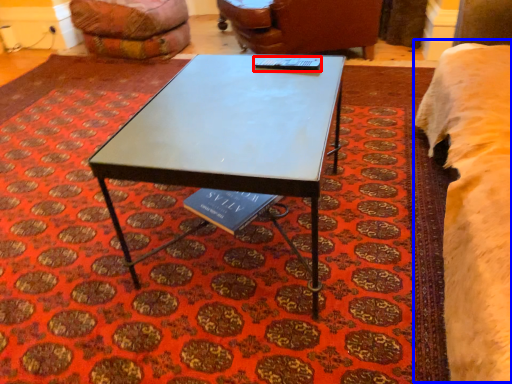
Question: Which object appears farthest to the camera in this image, table tennis table (highlighted by a red box) or bed (highlighted by a blue box)?

Choices:
 (A) table tennis table
 (B) bed

Answer: (A)